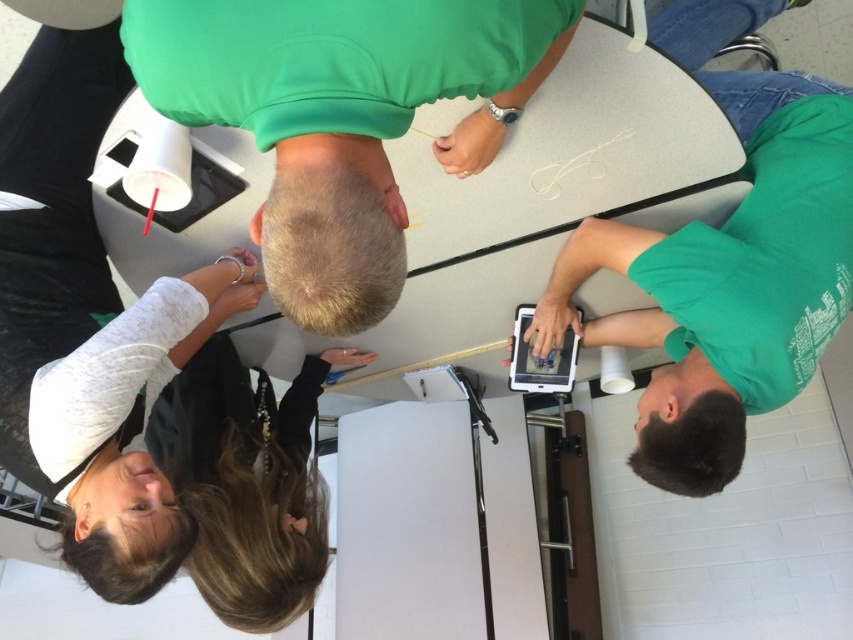
You are a photographer positioned at the center of the table. You want to take a photo of the dark brown hair at lower left without the green fabric headrest at upper center blocking the view. Is this possible?

The green fabric headrest at upper center is in front of the dark brown hair at lower left, so the headrest would block the view. Move to the side where the dark brown hair is visible without obstruction.

You are a person sitting at the table and want to reach both the green fabric headrest at upper center and the white matte cup at upper left. Which object is closer to your current position?

The white matte cup at upper left is closer because it is located below the green fabric headrest at upper center, which is above it.